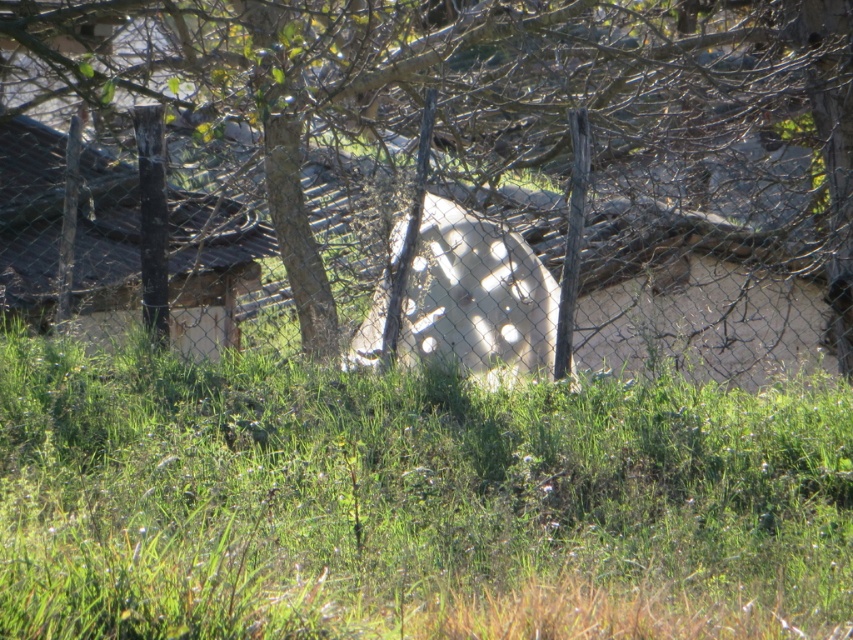
Question: Which object is the closest to the white matte concrete wheel at center?

Choices:
 (A) green grassy at center
 (B) green leafy tree at center

Answer: (B)

Question: Which object appears closest to the camera in this image?

Choices:
 (A) green grassy at center
 (B) green leafy tree at center
 (C) white matte concrete wheel at center

Answer: (A)

Question: Does green leafy tree at center appear on the right side of white matte concrete wheel at center?

Choices:
 (A) no
 (B) yes

Answer: (B)

Question: Does green leafy tree at center appear on the right side of green grassy at center?

Choices:
 (A) yes
 (B) no

Answer: (A)

Question: Which point is closer to the camera?

Choices:
 (A) green grassy at center
 (B) white matte concrete wheel at center
 (C) green leafy tree at center

Answer: (A)

Question: Does green leafy tree at center lie in front of green grassy at center?

Choices:
 (A) no
 (B) yes

Answer: (A)